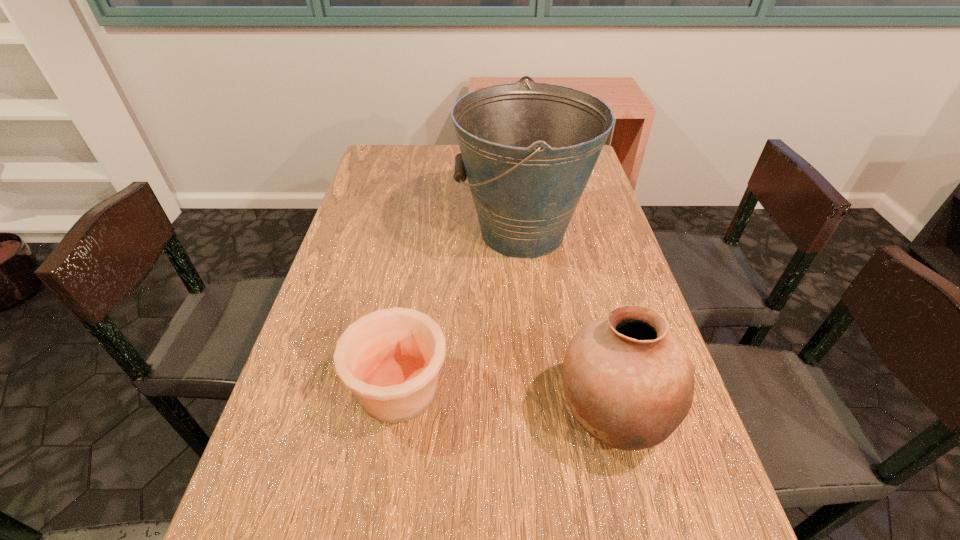
Locate an element on the screen. free location located on the back of the shorter pottery is located at coordinates (413, 301).

You are a GUI agent. You are given a task and a screenshot of the screen. Output one action in this format:
    pyautogui.click(x=<x>, y=<y>)
    Task: Click on the object at the left edge
    This screenshot has width=960, height=540.
    Given the screenshot: What is the action you would take?
    pyautogui.click(x=390, y=358)

This screenshot has height=540, width=960. I want to click on bucket at the right edge, so click(528, 150).

You are a GUI agent. You are given a task and a screenshot of the screen. Output one action in this format:
    pyautogui.click(x=<x>, y=<y>)
    Task: Click on the pottery present at the right edge
    This screenshot has height=540, width=960.
    Given the screenshot: What is the action you would take?
    pyautogui.click(x=629, y=382)

This screenshot has height=540, width=960. In order to click on vacant area at the far edge of the desktop in this screenshot , I will do `click(434, 162)`.

At what (x,y) coordinates should I click in order to perform the action: click on free spot at the left edge of the desktop. Please return your answer as a coordinate pair (x, y). This screenshot has height=540, width=960. Looking at the image, I should click on (385, 199).

In the image, there is a desktop. Identify the location of vacant space at the far left corner. (409, 168).

Locate an element on the screen. Image resolution: width=960 pixels, height=540 pixels. free space between the right pottery and the left pottery is located at coordinates (507, 401).

The image size is (960, 540). Identify the location of vacant space that's between the bucket and the right pottery. (568, 322).

Where is `free spot between the farthest object and the taller pottery`? The width and height of the screenshot is (960, 540). free spot between the farthest object and the taller pottery is located at coordinates 568,322.